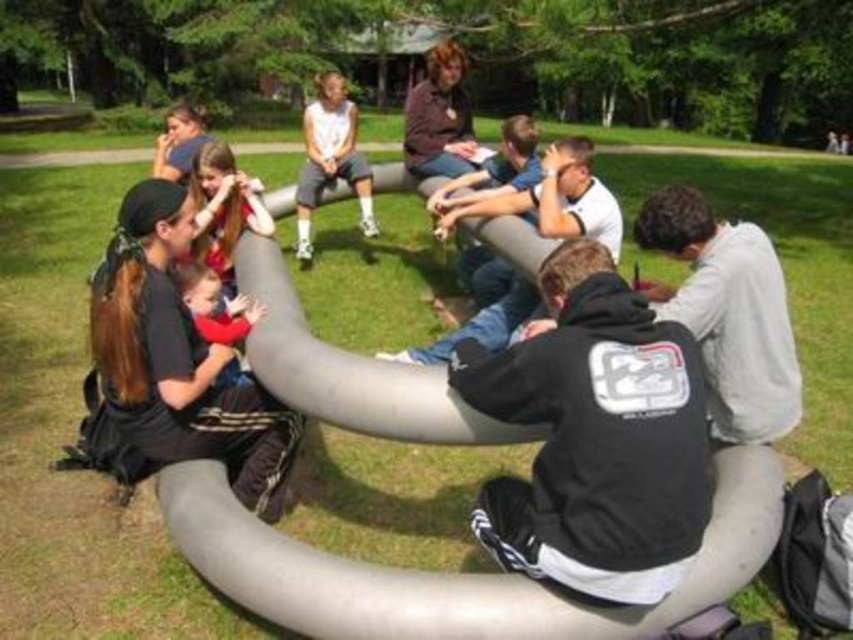
Which is more to the right, black matte shirt at lower left or matte red shirt at center?

From the viewer's perspective, matte red shirt at center appears more on the right side.

Does point (141, 406) come farther from viewer compared to point (219, 332)?

No, it is not.

Where is `black matte shirt at lower left`? black matte shirt at lower left is located at coordinates (178, 362).

In the scene shown: Between white matte shorts at center and matte red shirt at center, which one is positioned lower?

Positioned lower is matte red shirt at center.

The image size is (853, 640). Identify the location of white matte shorts at center. (x=329, y=157).

Between black fleece jacket at center and black matte shirt at lower left, which one has more height?

black matte shirt at lower left

Does black fleece jacket at center appear on the right side of black matte shirt at lower left?

Correct, you'll find black fleece jacket at center to the right of black matte shirt at lower left.

Is point (602, 500) in front of point (270, 486)?

Yes.

At what (x,y) coordinates should I click in order to perform the action: click on black fleece jacket at center. Please return your answer as a coordinate pair (x, y). Image resolution: width=853 pixels, height=640 pixels. Looking at the image, I should click on (595, 436).